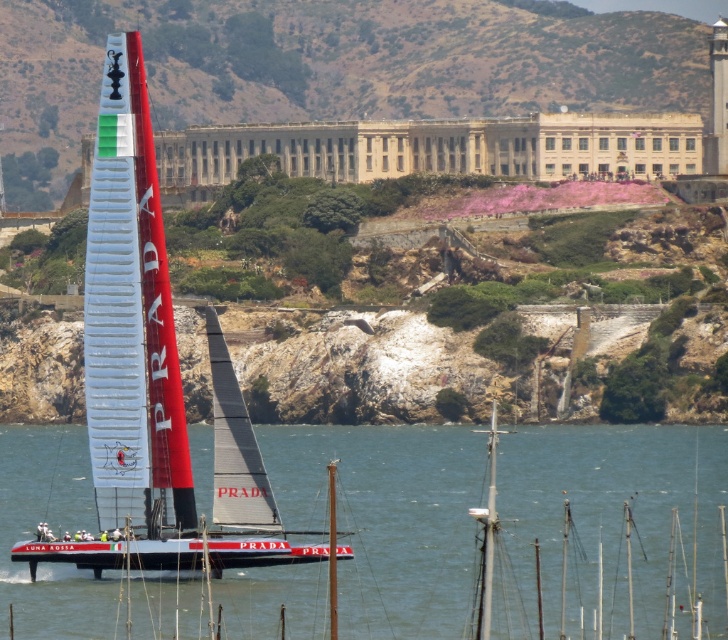
Does transparent water at center have a lesser width compared to white glossy sailboat at center?

No, transparent water at center is not thinner than white glossy sailboat at center.

Between transparent water at center and white glossy sailboat at center, which one has less height?

transparent water at center

Locate an element on the screen. This screenshot has width=728, height=640. transparent water at center is located at coordinates (605, 522).

This screenshot has height=640, width=728. I want to click on transparent water at center, so click(x=605, y=522).